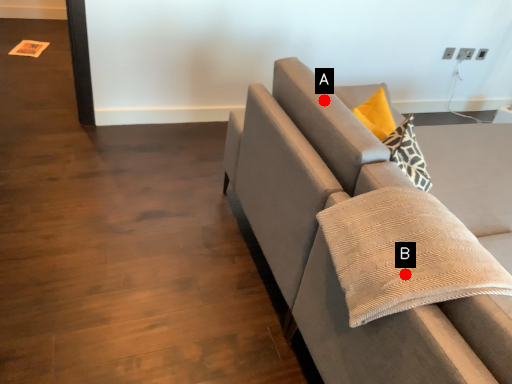
Question: Two points are circled on the image, labeled by A and B beside each circle. Which point is further to the camera?

Choices:
 (A) A is further
 (B) B is further

Answer: (A)